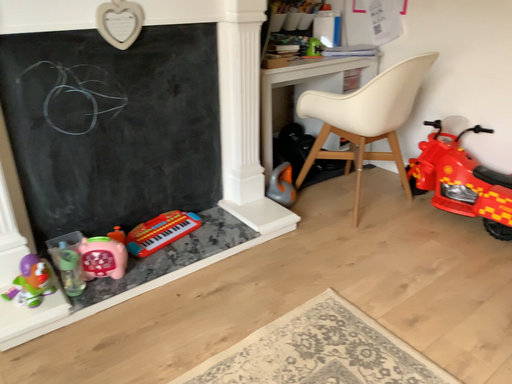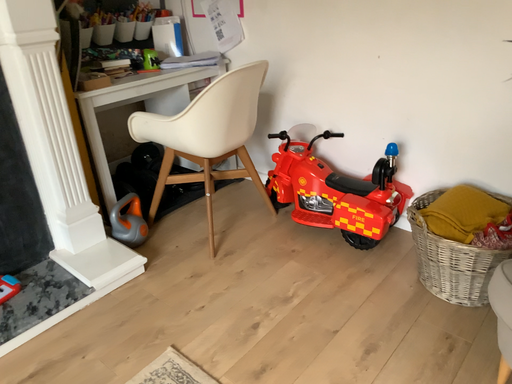
Question: Which way did the camera rotate in the video?

Choices:
 (A) rotated left
 (B) rotated right

Answer: (B)